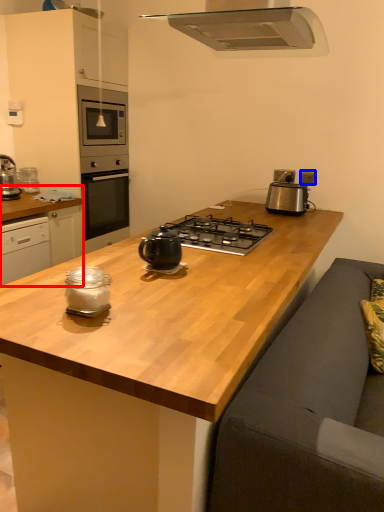
Question: Which of the following is the farthest to the observer, cabinetry (highlighted by a red box) or electric outlet (highlighted by a blue box)?

Choices:
 (A) cabinetry
 (B) electric outlet

Answer: (B)